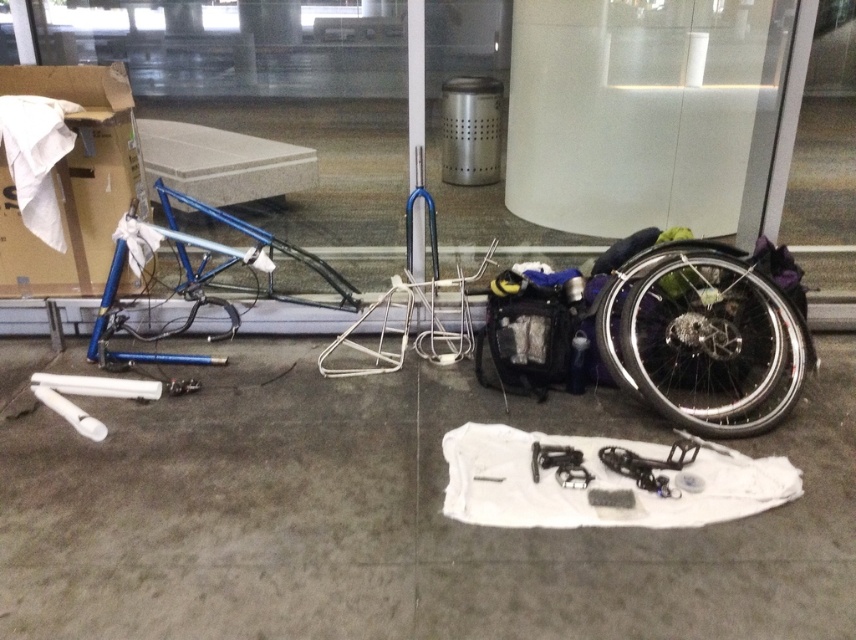
You are standing in the lobby and need to locate two specific points for maintenance. The first point is at coordinate point(810, 353) and the second is at point(123, 134). Which point is nearer to you?

Point(810, 353) is closer to the viewer than point(123, 134).